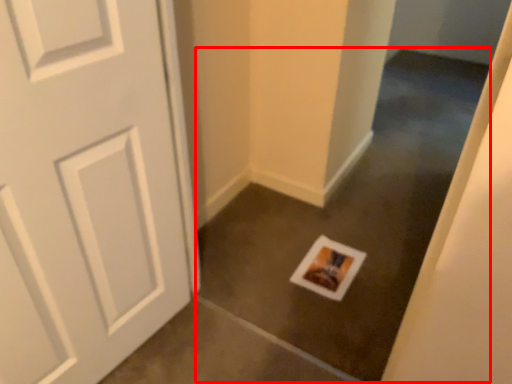
Question: From the image's perspective, what is the correct spatial positioning of concrete (annotated by the red box) in reference to postcard?

Choices:
 (A) below
 (B) above

Answer: (B)